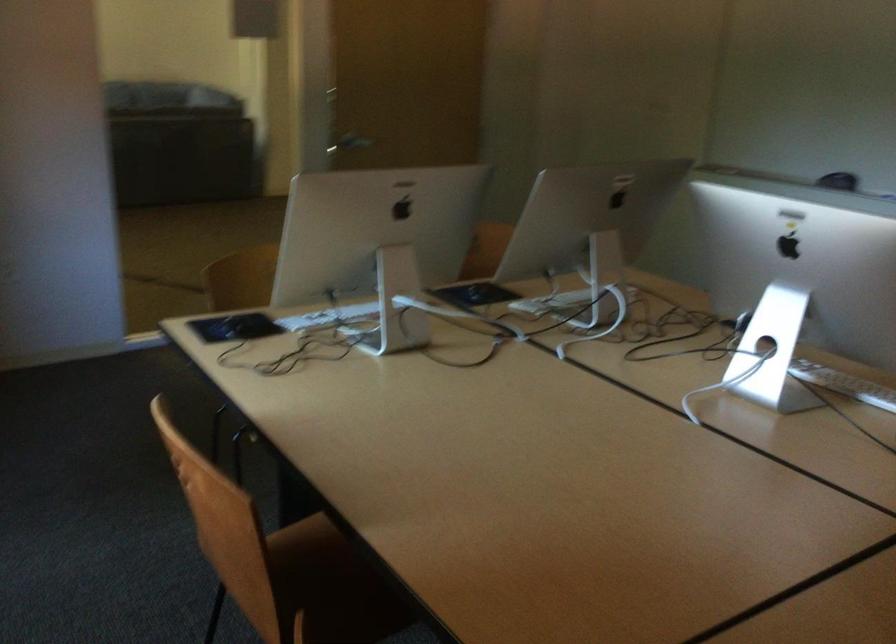
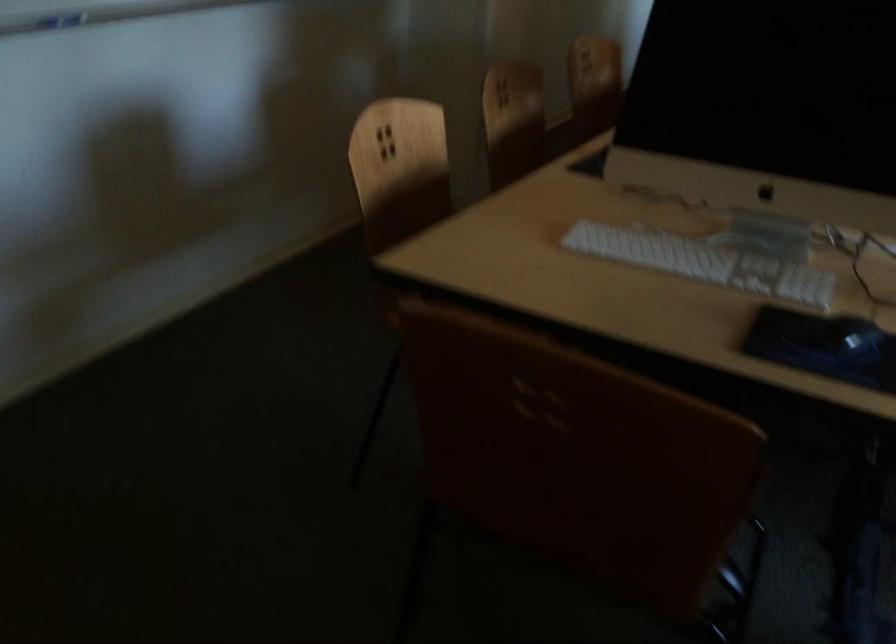
The point at [470,303] is marked in the first image. Where is the corresponding point in the second image?

(860, 345)